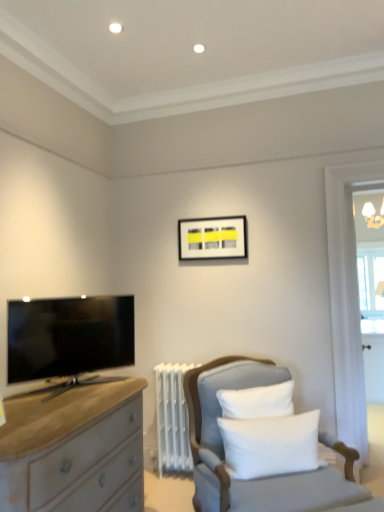
Question: Does light gray fabric chair at lower right contain matte black picture frame at upper center?

Choices:
 (A) no
 (B) yes

Answer: (A)

Question: Can you confirm if light gray fabric chair at lower right is wider than matte black picture frame at upper center?

Choices:
 (A) no
 (B) yes

Answer: (B)

Question: From a real-world perspective, is light gray fabric chair at lower right beneath matte black picture frame at upper center?

Choices:
 (A) no
 (B) yes

Answer: (B)

Question: Does light gray fabric chair at lower right have a larger size compared to matte black picture frame at upper center?

Choices:
 (A) yes
 (B) no

Answer: (A)

Question: Does light gray fabric chair at lower right have a smaller size compared to matte black picture frame at upper center?

Choices:
 (A) yes
 (B) no

Answer: (B)

Question: From the image's perspective, is light gray fabric chair at lower right beneath matte black picture frame at upper center?

Choices:
 (A) no
 (B) yes

Answer: (B)

Question: Would you say clear glass window at right contains light gray fabric chair at lower right?

Choices:
 (A) no
 (B) yes

Answer: (A)

Question: Is clear glass window at right at the left side of light gray fabric chair at lower right?

Choices:
 (A) yes
 (B) no

Answer: (B)

Question: Are clear glass window at right and light gray fabric chair at lower right making contact?

Choices:
 (A) no
 (B) yes

Answer: (A)

Question: Is clear glass window at right wider than light gray fabric chair at lower right?

Choices:
 (A) no
 (B) yes

Answer: (A)

Question: Is clear glass window at right outside light gray fabric chair at lower right?

Choices:
 (A) yes
 (B) no

Answer: (A)

Question: Considering the relative sizes of clear glass window at right and light gray fabric chair at lower right in the image provided, is clear glass window at right smaller than light gray fabric chair at lower right?

Choices:
 (A) no
 (B) yes

Answer: (B)

Question: From the image's perspective, is matte black tv at left above white soft cushion at center?

Choices:
 (A) yes
 (B) no

Answer: (A)